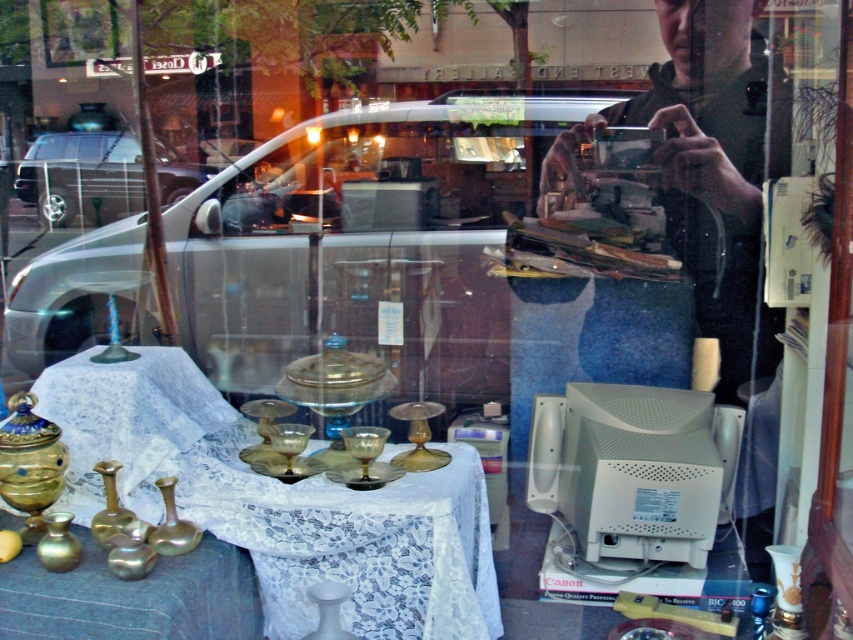
Question: Which is nearer to the metallic silver van at left?

Choices:
 (A) dark green shirt at upper right
 (B) white lace tablecloth at lower left

Answer: (B)

Question: Which object is the closest to the metallic silver van at left?

Choices:
 (A) dark green shirt at upper right
 (B) white lace tablecloth at lower left

Answer: (B)

Question: Is white lace tablecloth at lower left in front of dark green shirt at upper right?

Choices:
 (A) yes
 (B) no

Answer: (A)

Question: Can you confirm if white lace tablecloth at lower left is positioned to the left of metallic silver van at left?

Choices:
 (A) no
 (B) yes

Answer: (A)

Question: Among these points, which one is farthest from the camera?

Choices:
 (A) (393, 620)
 (B) (189, 170)

Answer: (B)

Question: Is dark green shirt at upper right below metallic silver van at left?

Choices:
 (A) no
 (B) yes

Answer: (B)